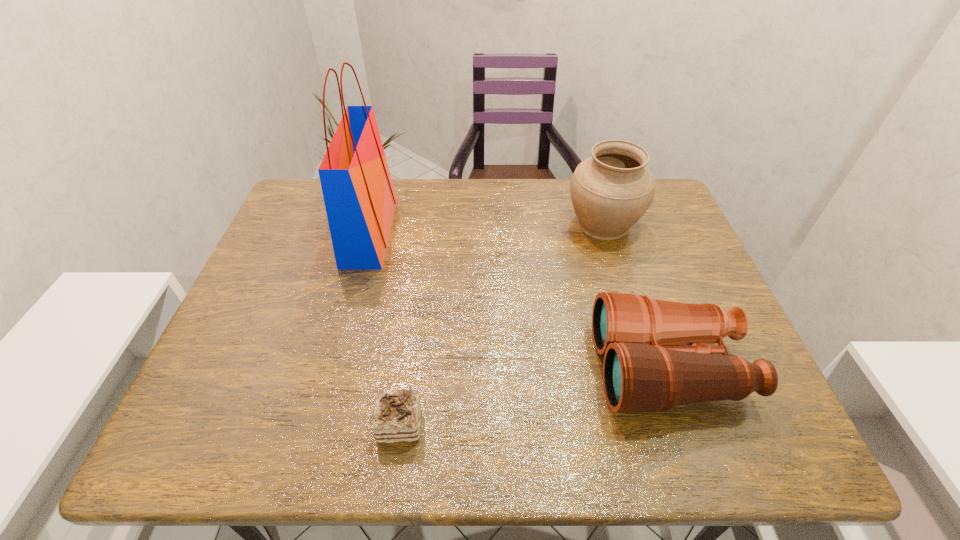
I want to click on the tallest object, so click(359, 196).

Where is `shopping bag`? The width and height of the screenshot is (960, 540). shopping bag is located at coordinates (359, 196).

The height and width of the screenshot is (540, 960). Identify the location of urn. click(610, 191).

At what (x,y) coordinates should I click in order to perform the action: click on the second shortest object. Please return your answer as a coordinate pair (x, y). Looking at the image, I should click on (645, 370).

Where is `the shortest object`? the shortest object is located at coordinates (396, 419).

The height and width of the screenshot is (540, 960). In order to click on chocolate cake in this screenshot , I will do `click(396, 419)`.

At what (x,y) coordinates should I click in order to perform the action: click on free point located 0.200m on the handle side of the tallest object. Please return your answer as a coordinate pair (x, y). The height and width of the screenshot is (540, 960). Looking at the image, I should click on (462, 232).

Where is `blank space located on the front of the urn`? The height and width of the screenshot is (540, 960). blank space located on the front of the urn is located at coordinates (618, 276).

Image resolution: width=960 pixels, height=540 pixels. What are the coordinates of `free region located through the lenses of the third tallest object` in the screenshot? It's located at (464, 368).

I want to click on blank area located through the lenses of the third tallest object, so click(x=450, y=368).